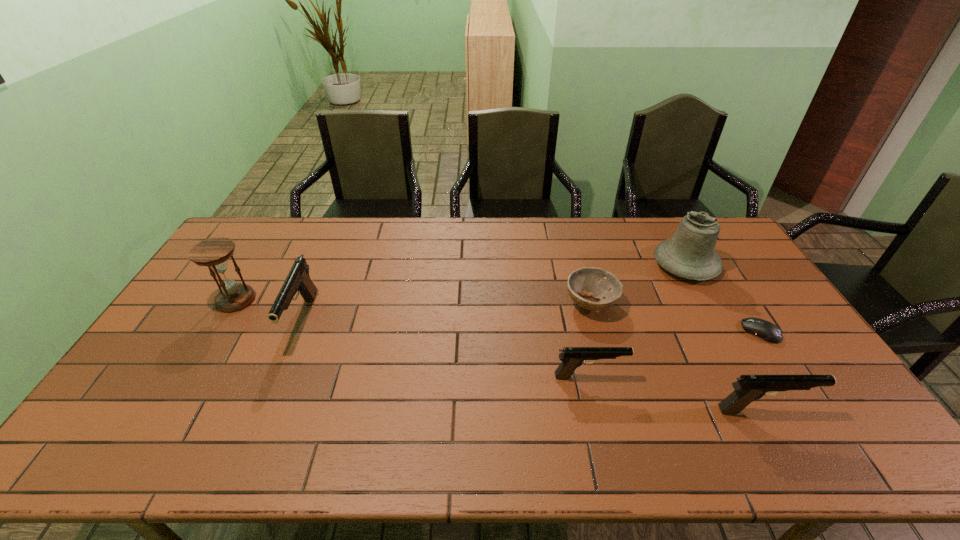
The height and width of the screenshot is (540, 960). Find the location of `spot to insert another pistol for uniform distribution`. spot to insert another pistol for uniform distribution is located at coordinates (437, 346).